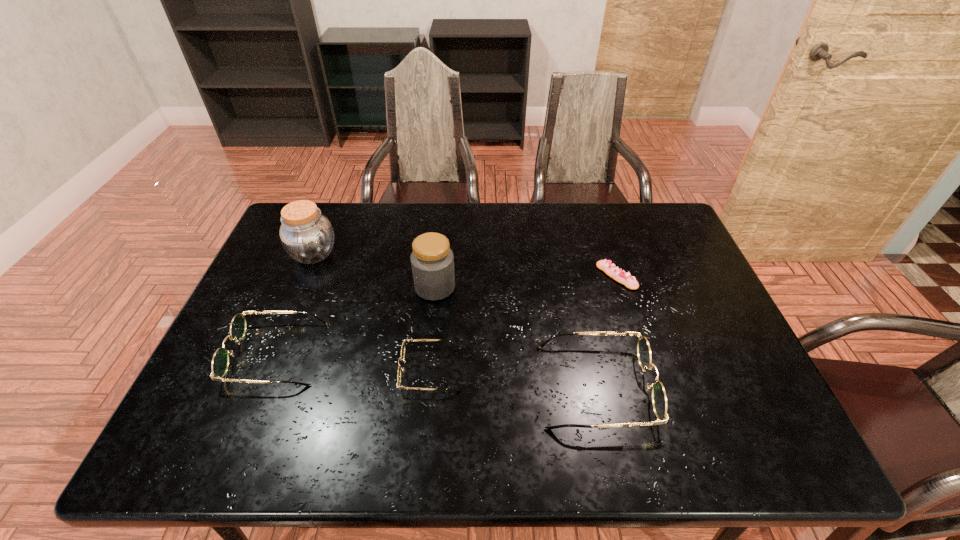
Locate an element on the screen. The image size is (960, 540). free location located 0.340m on the lenses of the second spectacles from left to right is located at coordinates (261, 369).

Find the location of `free spot located on the lenses of the rightmost spectacles`. free spot located on the lenses of the rightmost spectacles is located at coordinates (760, 386).

In order to click on free space located on the surface of the nearer jar near the warning symbol in this screenshot , I will do `click(565, 287)`.

Locate an element on the screen. free space located on the right of the left jar is located at coordinates (453, 254).

Locate an element on the screen. Image resolution: width=960 pixels, height=540 pixels. free location located on the front of the shortest object is located at coordinates (637, 341).

The image size is (960, 540). I want to click on object that is at the far edge, so click(306, 235).

The height and width of the screenshot is (540, 960). I want to click on spectacles positioned at the left edge, so click(220, 362).

You are a GUI agent. You are given a task and a screenshot of the screen. Output one action in this format:
    pyautogui.click(x=<x>, y=<y>)
    Task: Click on the jar that is at the left edge
    Image resolution: width=960 pixels, height=540 pixels.
    Given the screenshot: What is the action you would take?
    pyautogui.click(x=306, y=235)

This screenshot has height=540, width=960. Find the location of `object located at the far left corner`. object located at the far left corner is located at coordinates (306, 235).

The height and width of the screenshot is (540, 960). I want to click on object that is at the near left corner, so click(220, 362).